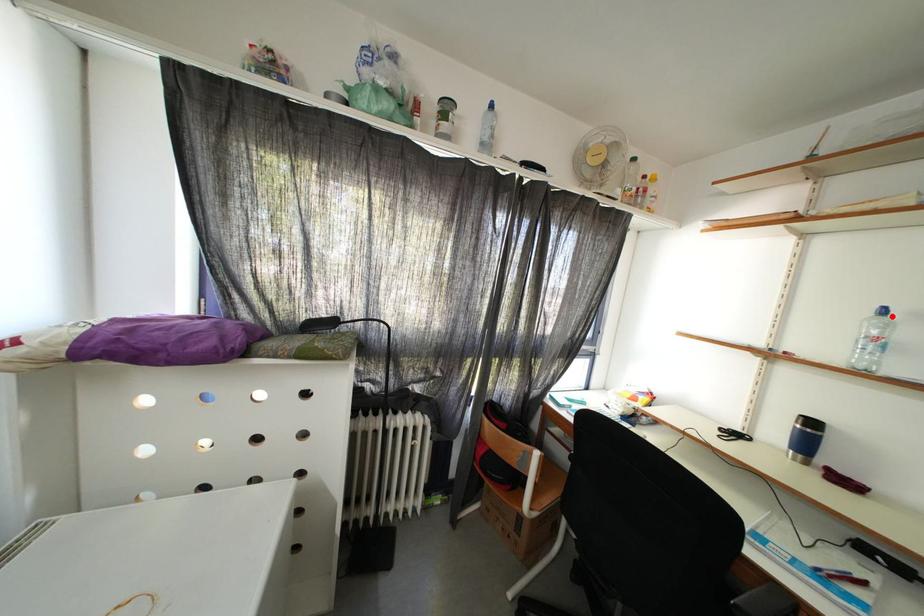
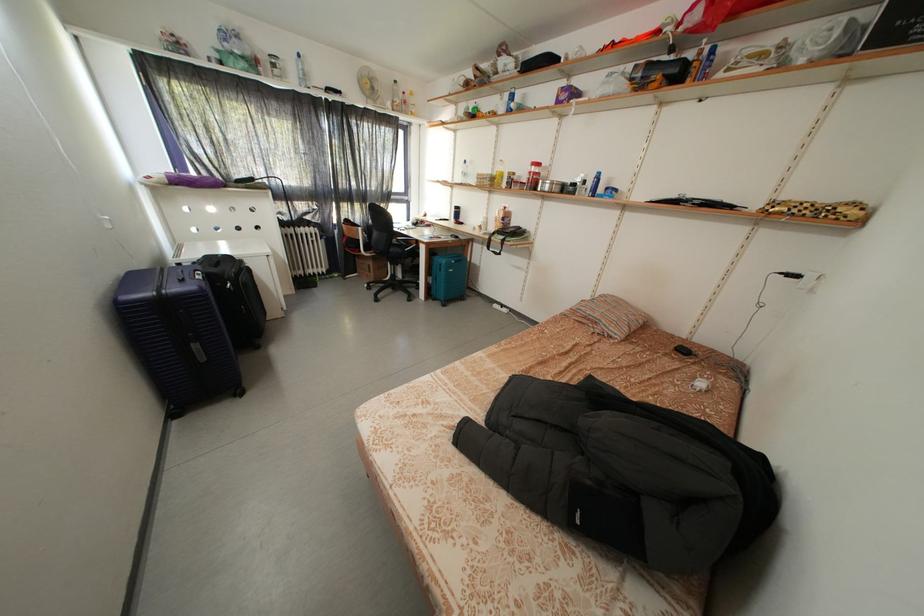
Where in the second image is the point corresponding to the highlighted location from the first image?

(472, 167)